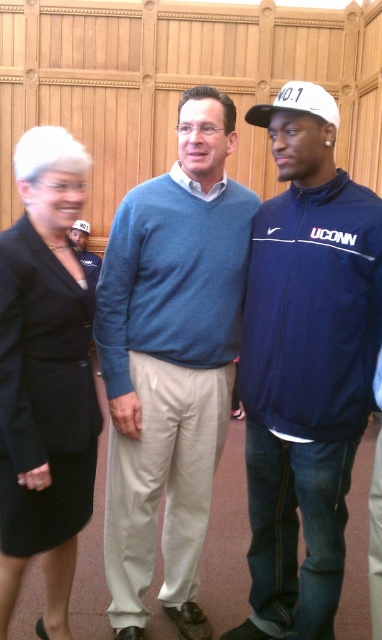
Who is shorter, matte blue sweater at center or white matte baseball cap at upper center?

white matte baseball cap at upper center is shorter.

Does matte blue sweater at center have a lesser height compared to white matte baseball cap at upper center?

No, matte blue sweater at center is not shorter than white matte baseball cap at upper center.

Is point (87, 237) positioned behind point (74, 228)?

Yes, point (87, 237) is farther from viewer.

Where is `matte blue sweater at center`? matte blue sweater at center is located at coordinates (85, 250).

Does navy blue jacket at center lie behind white matte baseball cap at upper center?

No, navy blue jacket at center is in front of white matte baseball cap at upper center.

Is navy blue jacket at center in front of white matte baseball cap at upper center?

Yes.

What do you see at coordinates (305, 365) in the screenshot? This screenshot has height=640, width=382. I see `navy blue jacket at center` at bounding box center [305, 365].

I want to click on navy blue jacket at center, so click(305, 365).

Does point (247, 636) come farther from viewer compared to point (236, 300)?

Yes, point (247, 636) is behind point (236, 300).

Does navy blue jacket at center appear under blue sweater at center?

Indeed, navy blue jacket at center is positioned under blue sweater at center.

Which is in front, point (271, 257) or point (169, 554)?

Point (271, 257)

Identify the location of navy blue jacket at center. (305, 365).